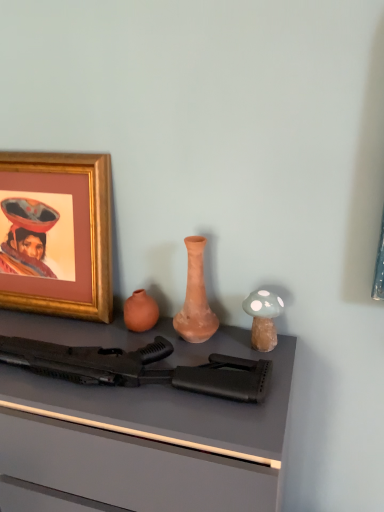
What are the coordinates of `free space to the left of matte clay vase at center` in the screenshot? It's located at (136, 331).